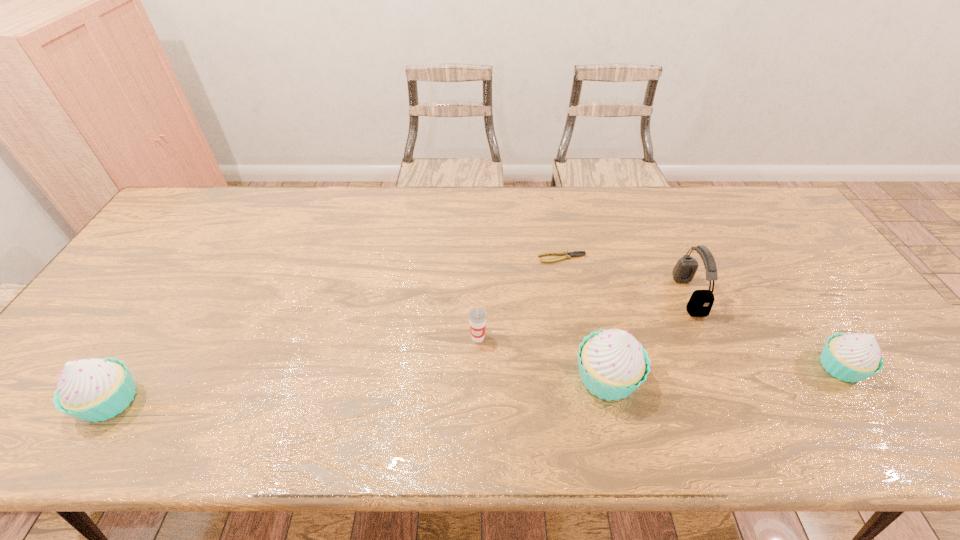
You are a GUI agent. You are given a task and a screenshot of the screen. Output one action in this format:
    pyautogui.click(x=<x>, y=<y>)
    Task: Click on the leftmost cupcake
    The height and width of the screenshot is (540, 960).
    Given the screenshot: What is the action you would take?
    pyautogui.click(x=92, y=389)

Locate an element on the screen. The width and height of the screenshot is (960, 540). the leftmost object is located at coordinates (92, 389).

Locate an element on the screen. the second cupcake from right to left is located at coordinates (612, 364).

Image resolution: width=960 pixels, height=540 pixels. In order to click on the rightmost object in this screenshot , I will do `click(853, 357)`.

The image size is (960, 540). In order to click on the shortest cupcake in this screenshot , I will do pyautogui.click(x=853, y=357).

Find the location of `pliers`. pliers is located at coordinates (566, 255).

At what (x,y) coordinates should I click in order to perform the action: click on the farthest object. Please return your answer as a coordinate pair (x, y). The width and height of the screenshot is (960, 540). Looking at the image, I should click on (566, 255).

Locate an element on the screen. Image resolution: width=960 pixels, height=540 pixels. the second object from right to left is located at coordinates (700, 303).

Identify the location of headset. The height and width of the screenshot is (540, 960). (700, 303).

Locate an element on the screen. the third farthest object is located at coordinates (477, 316).